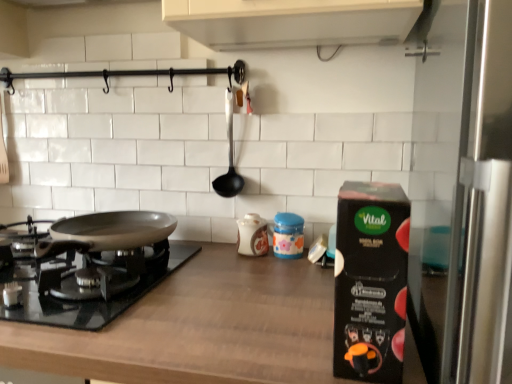
Question: Based on their sizes in the image, would you say silver metallic pan at lower left is bigger or smaller than black cardboard box at right, acting as the 3th kitchen appliance starting from the back?

Choices:
 (A) small
 (B) big

Answer: (B)

Question: Choose the correct answer: Is silver metallic pan at lower left inside black cardboard box at right, the first kitchen appliance positioned from the right, or outside it?

Choices:
 (A) outside
 (B) inside

Answer: (A)

Question: Which object is positioned farthest from the matte ceramic jar at center, the 2th kitchen appliance when ordered from back to front?

Choices:
 (A) brown wood countertop at center
 (B) matte ceramic jar at center, the 1th kitchen appliance in the back-to-front sequence
 (C) silver metallic pan at lower left
 (D) black cardboard box at right, the first kitchen appliance positioned from the right
 (E) black plastic ladle at center

Answer: (D)

Question: Considering the real-world distances, which object is farthest from the brown wood countertop at center?

Choices:
 (A) silver metallic pan at lower left
 (B) matte ceramic jar at center, the 1th kitchen appliance in the back-to-front sequence
 (C) black cardboard box at right, which appears as the 1th kitchen appliance when viewed from the front
 (D) matte ceramic jar at center, which is the second kitchen appliance in front-to-back order
 (E) black plastic ladle at center

Answer: (E)